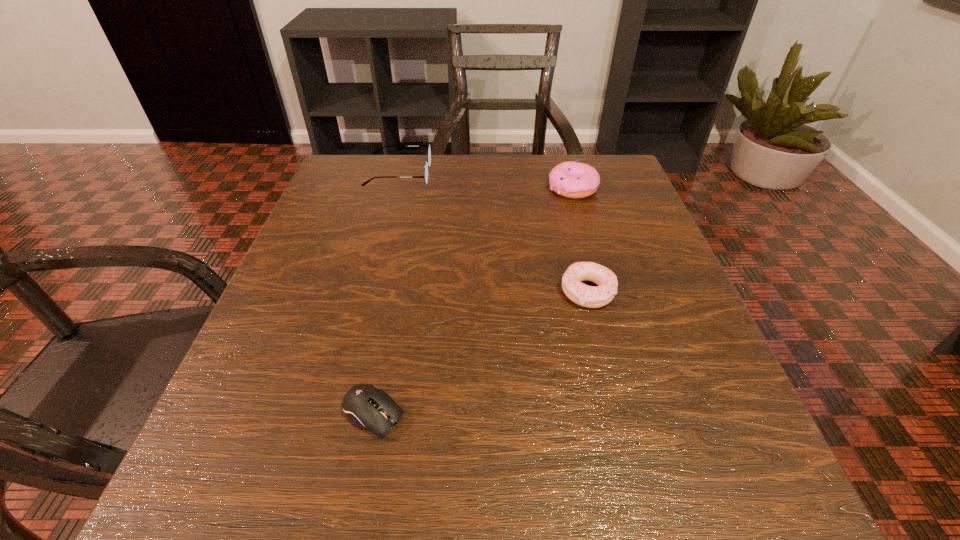
Where is `spectacles`? The height and width of the screenshot is (540, 960). spectacles is located at coordinates (428, 163).

Locate an element on the screen. This screenshot has width=960, height=540. the farther doughnut is located at coordinates (575, 180).

Where is `the third farthest object`? This screenshot has height=540, width=960. the third farthest object is located at coordinates (587, 296).

Where is `the nearer doughnut`? the nearer doughnut is located at coordinates (587, 296).

This screenshot has width=960, height=540. Find the location of `the nearest object`. the nearest object is located at coordinates (366, 406).

At what (x,y) coordinates should I click in order to perform the action: click on vacant space situated on the lenses of the spectacles. Please return your answer as a coordinate pair (x, y). The width and height of the screenshot is (960, 540). Looking at the image, I should click on (559, 174).

Image resolution: width=960 pixels, height=540 pixels. Find the location of `vacant space located 0.380m on the left of the farther doughnut`. vacant space located 0.380m on the left of the farther doughnut is located at coordinates (383, 188).

Identify the location of free space located on the left of the nearer doughnut. This screenshot has width=960, height=540. (480, 292).

This screenshot has width=960, height=540. Find the location of `vacant space located on the left of the nearest object`. vacant space located on the left of the nearest object is located at coordinates (239, 414).

Locate an element on the screen. The height and width of the screenshot is (540, 960). spectacles at the far edge is located at coordinates pyautogui.click(x=428, y=163).